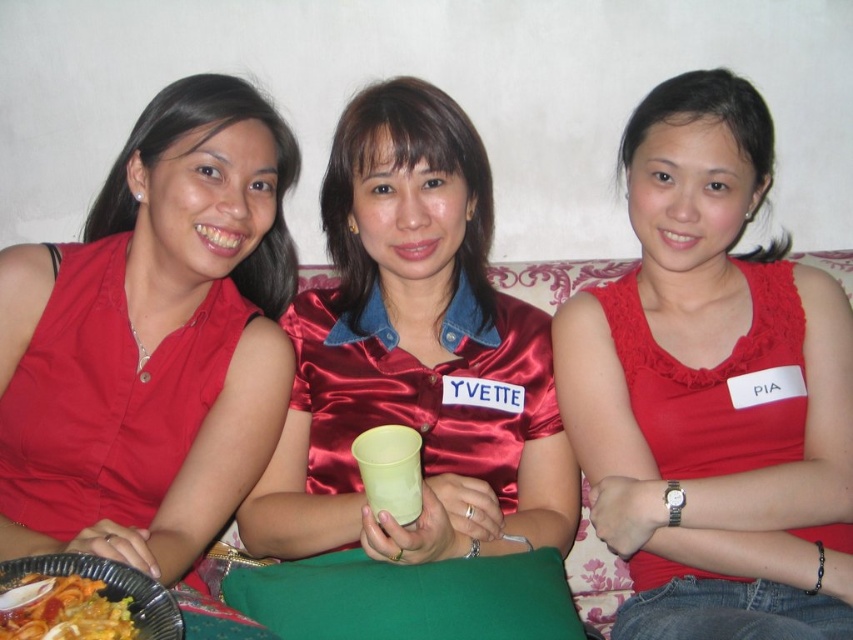
You are a photographer standing at a certain distance from the three women wearing the satin red dress at center. You want to take a closeup shot of their faces without the dress being in the frame. Is the current distance sufficient to do so?

The distance between the satin red dress at center and the camera is 36.09 inches. To capture a closeup of their faces without the dress in the frame, you would need to move closer than 36.09 inches to focus solely on their faces.